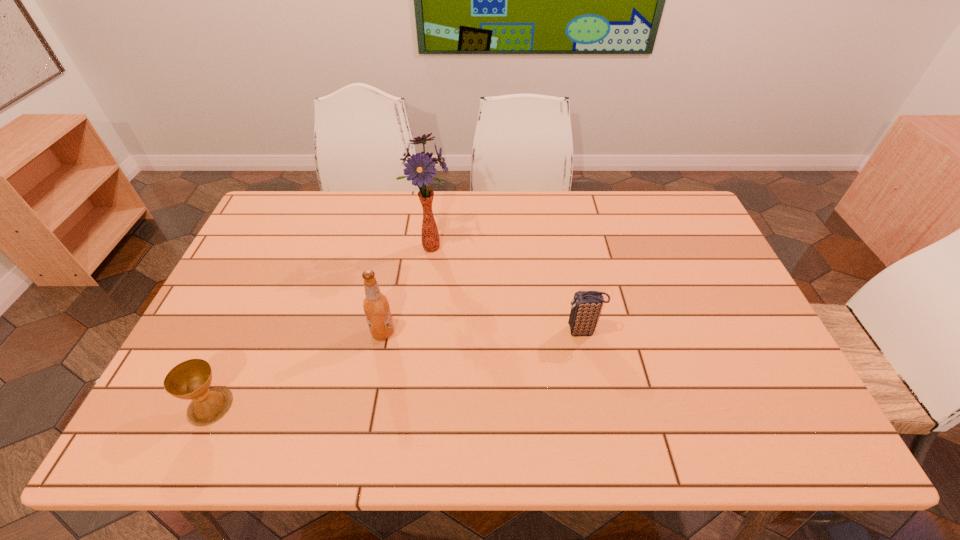
Find the location of a particular element. Image resolution: width=960 pixels, height=540 pixels. free point located with the zip open on the second shortest object is located at coordinates (444, 331).

Identify the location of vacant space located with the zip open on the second shortest object. The image size is (960, 540). (433, 331).

The height and width of the screenshot is (540, 960). Find the location of `free space located on the back of the chalice`. free space located on the back of the chalice is located at coordinates (258, 301).

Where is `object located in the far edge section of the desktop`? object located in the far edge section of the desktop is located at coordinates (419, 168).

I want to click on object present at the near edge, so (x=191, y=379).

Locate an element on the screen. This screenshot has height=540, width=960. object located in the left edge section of the desktop is located at coordinates (191, 379).

The width and height of the screenshot is (960, 540). I want to click on object at the near left corner, so click(x=191, y=379).

I want to click on vacant area at the far edge, so click(540, 230).

You are a GUI agent. You are given a task and a screenshot of the screen. Output one action in this format:
    pyautogui.click(x=<x>, y=<y>)
    Task: Click on the blank space at the near edge
    
    Given the screenshot: What is the action you would take?
    pyautogui.click(x=254, y=427)

The height and width of the screenshot is (540, 960). Identify the location of vacant region at the left edge of the desktop. (268, 279).